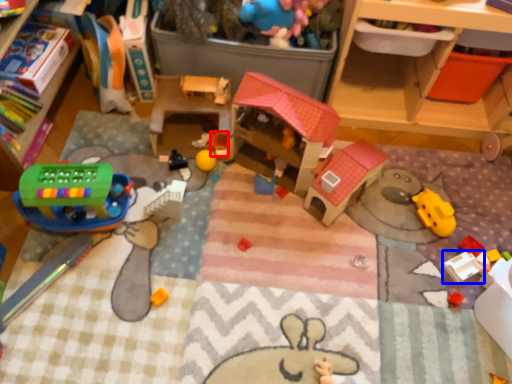
Question: Which object is closer to the camera taking this photo, toy (highlighted by a red box) or toy (highlighted by a blue box)?

Choices:
 (A) toy
 (B) toy

Answer: (B)